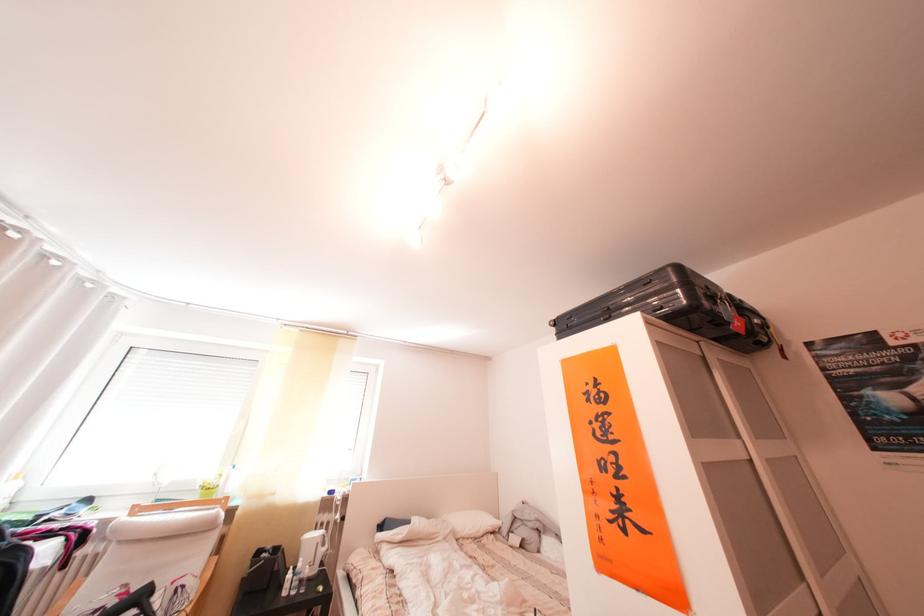
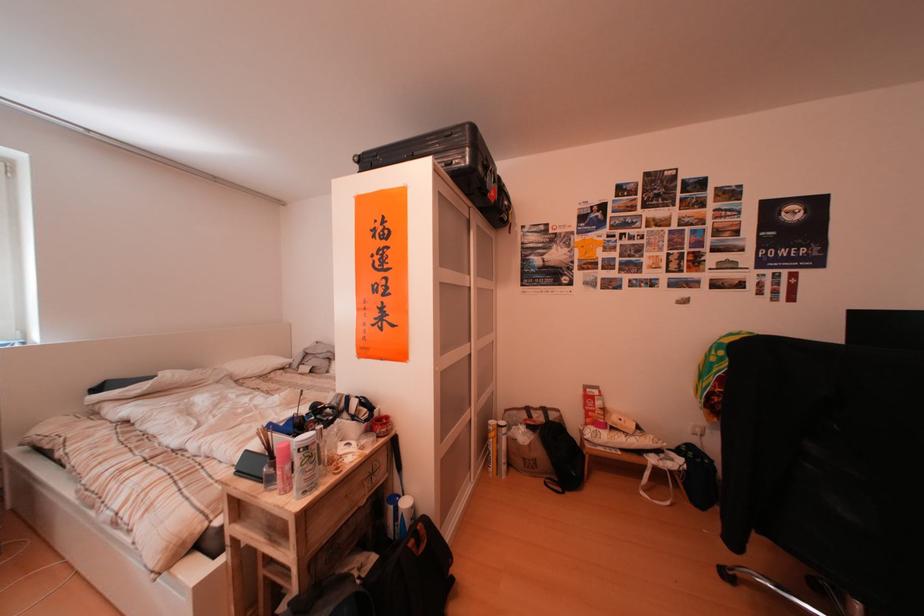
Find the pixel in the second image that matches point (566, 331) in the first image.

(371, 167)